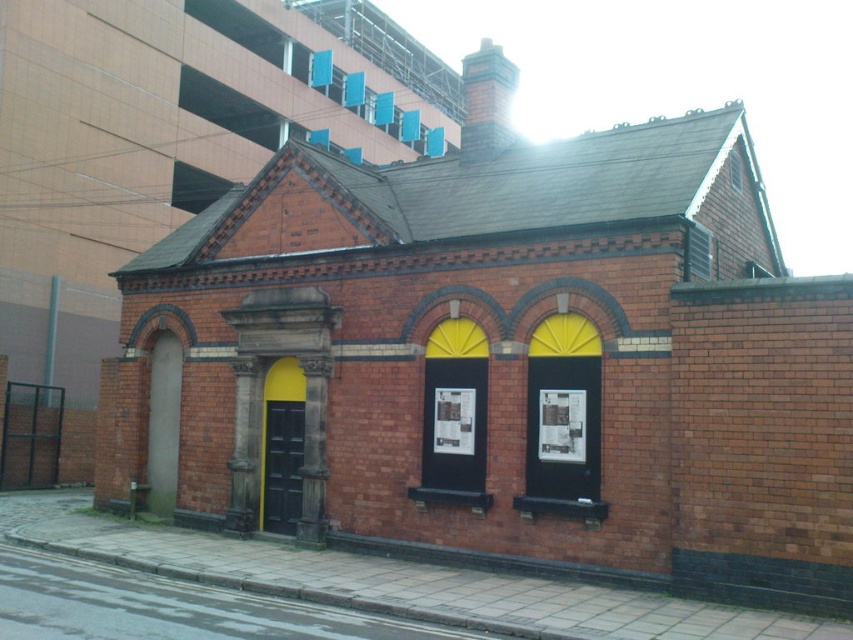
You are a delivery person with a 20 feet long ladder. You need to reach the clear glass window at upper center from the black wooden door at center. Can you reach it with your ladder?

The distance between the black wooden door at center and the clear glass window at upper center is 26.87 feet. Since the ladder is only 20 feet long, it is not long enough to reach the window from the door.

You are standing in front of the small traditional brick building. You see a point at coordinates (x=282, y=465). What object is located at that point?

The point at coordinates (x=282, y=465) corresponds to the black wooden door at center.